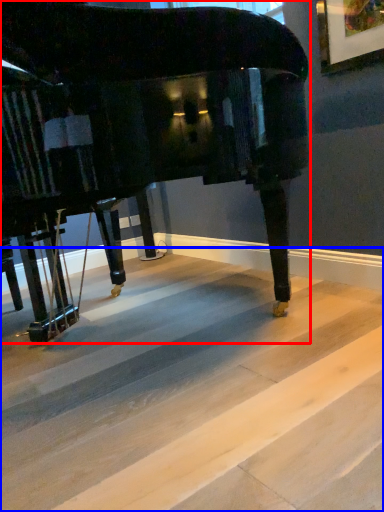
Question: Which object is closer to the camera taking this photo, piano (highlighted by a red box) or concrete (highlighted by a blue box)?

Choices:
 (A) piano
 (B) concrete

Answer: (B)